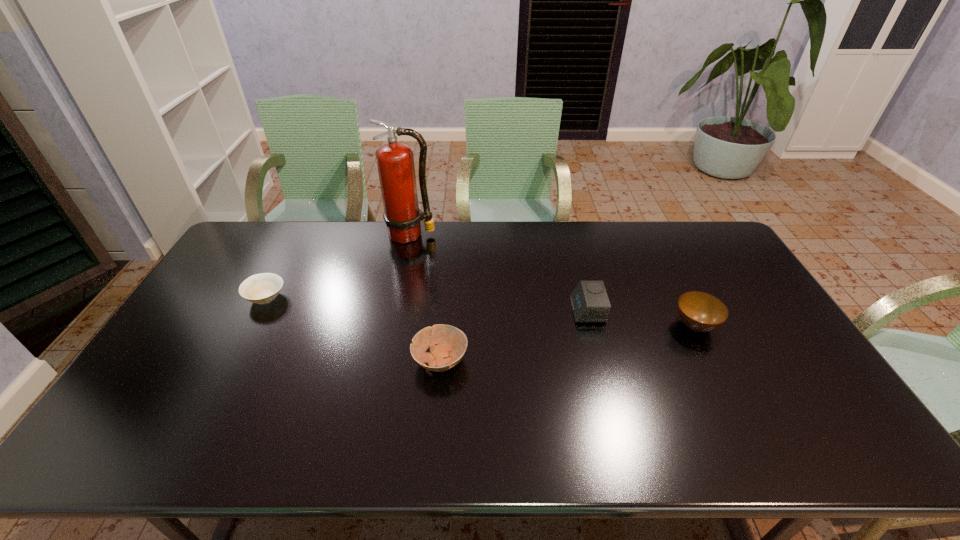
Identify the location of the farthest object. (395, 161).

The height and width of the screenshot is (540, 960). What are the coordinates of `the tallest object` in the screenshot? It's located at (395, 161).

The height and width of the screenshot is (540, 960). What are the coordinates of `alarm clock` in the screenshot? It's located at (589, 300).

This screenshot has width=960, height=540. In order to click on the rightmost object in this screenshot , I will do `click(699, 311)`.

Identify the location of the second bowl from right to left. The image size is (960, 540). (451, 342).

Identify the location of the leftmost bowl. This screenshot has width=960, height=540. (262, 288).

Locate an element on the screen. Image resolution: width=960 pixels, height=540 pixels. the shortest bowl is located at coordinates (262, 288).

Find the location of a particular element. Image resolution: width=960 pixels, height=540 pixels. free space located 0.110m at the nozzle of the tallest object is located at coordinates (404, 265).

I want to click on vacant space located 0.370m on the front-facing side of the alarm clock, so click(450, 310).

What are the coordinates of `vacant space located 0.160m on the front-facing side of the alarm clock` in the screenshot? It's located at [519, 310].